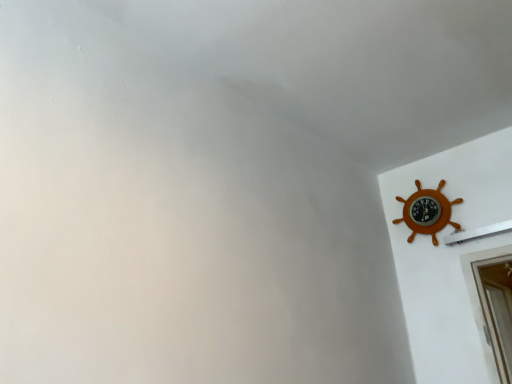
Image resolution: width=512 pixels, height=384 pixels. What are the coordinates of `wooden ship wheel at upper right` in the screenshot? It's located at (426, 212).

Describe the element at coordinates (426, 212) in the screenshot. This screenshot has height=384, width=512. I see `wooden ship wheel at upper right` at that location.

You are a GUI agent. You are given a task and a screenshot of the screen. Output one action in this format:
    pyautogui.click(x=<x>, y=<y>)
    Task: Click on the wooden ship wheel at upper right
    
    Given the screenshot: What is the action you would take?
    pyautogui.click(x=426, y=212)